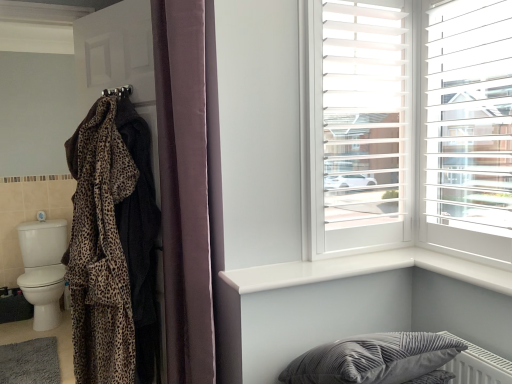
Where is `vacant space in front of white plastic window frame at upper right`? Image resolution: width=512 pixels, height=384 pixels. vacant space in front of white plastic window frame at upper right is located at coordinates (357, 266).